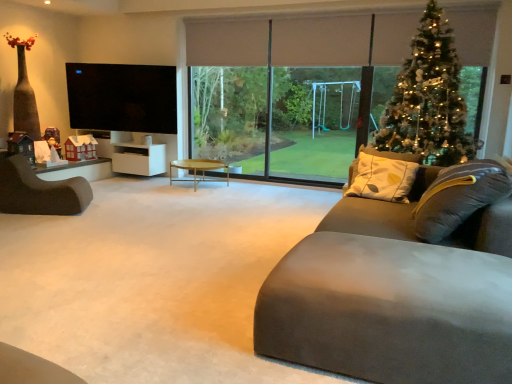
Locate an element on the screen. The height and width of the screenshot is (384, 512). wooden round coffee table at center is located at coordinates (199, 169).

Identify the location of black glossy flat-screen tv at upper left. This screenshot has width=512, height=384. (122, 97).

I want to click on iridescent metallic christmas tree at upper right, so click(x=428, y=99).

What is the approximate height of white matte cabinet at left?

It is 17.47 inches.

Image resolution: width=512 pixels, height=384 pixels. In order to click on wooden round coffee table at center in this screenshot , I will do `click(199, 169)`.

Would you say wooden round coffee table at center is part of dark brown leather chair at left's contents?

Definitely not — wooden round coffee table at center is not inside dark brown leather chair at left.

From a real-world perspective, is dark brown leather chair at left positioned above or below wooden round coffee table at center?

In terms of real-world spatial position, dark brown leather chair at left is above wooden round coffee table at center.

Who is shorter, dark brown leather chair at left or wooden round coffee table at center?

Standing shorter between the two is wooden round coffee table at center.

In the scene shown: Could you tell me if dark brown leather chair at left is turned towards wooden round coffee table at center?

No.

From a real-world perspective, is wooden round coffee table at center beneath transparent glass window at center?

Indeed, from a real-world perspective, wooden round coffee table at center is positioned beneath transparent glass window at center.

Considering the positions of points (184, 165) and (201, 120), is point (184, 165) farther from camera compared to point (201, 120)?

Yes.

From the image's perspective, is wooden round coffee table at center positioned above or below transparent glass window at center?

Based on their image positions, wooden round coffee table at center is located beneath transparent glass window at center.

Is suede couch at lower right taller or shorter than transparent glass window at center?

suede couch at lower right is shorter than transparent glass window at center.

Are suede couch at lower right and transparent glass window at center beside each other?

No, suede couch at lower right is not making contact with transparent glass window at center.

Is suede couch at lower right not within transparent glass window at center?

Yes, suede couch at lower right is outside of transparent glass window at center.

The height and width of the screenshot is (384, 512). I want to click on window above the suede couch at lower right (from a real-world perspective), so click(287, 88).

Is suede-like gray couch at lower right far from transparent glass window at center?

Yes, suede-like gray couch at lower right and transparent glass window at center are located far from each other.

In the scene shown: Considering the relative sizes of suede-like gray couch at lower right and transparent glass window at center in the image provided, is suede-like gray couch at lower right thinner than transparent glass window at center?

Incorrect, the width of suede-like gray couch at lower right is not less than that of transparent glass window at center.

You are a GUI agent. You are given a task and a screenshot of the screen. Output one action in this format:
    pyautogui.click(x=<x>, y=<y>)
    Task: Click on the window behind the suede-like gray couch at lower right
    
    Given the screenshot: What is the action you would take?
    pyautogui.click(x=287, y=88)

Can you confirm if suede-like gray couch at lower right is taller than transparent glass window at center?

No.

Does wooden round coffee table at center have a greater width compared to suede couch at lower right?

Incorrect, the width of wooden round coffee table at center does not surpass that of suede couch at lower right.

Which object is positioned more to the left, wooden round coffee table at center or suede couch at lower right?

From the viewer's perspective, suede couch at lower right appears more on the left side.

Looking at the image, does wooden round coffee table at center seem bigger or smaller compared to suede couch at lower right?

Considering their sizes, wooden round coffee table at center takes up less space than suede couch at lower right.

Is wooden round coffee table at center directly adjacent to suede couch at lower right?

wooden round coffee table at center and suede couch at lower right are clearly separated.

From the image's perspective, between dark brown leather chair at left and suede couch at lower right, which one is located above?

dark brown leather chair at left, from the image's perspective.

Does dark brown leather chair at left have a greater height compared to suede couch at lower right?

Correct, dark brown leather chair at left is much taller as suede couch at lower right.

Which of these two, dark brown leather chair at left or suede couch at lower right, is bigger?

suede couch at lower right.

Is dark brown leather chair at left touching suede couch at lower right?

No, dark brown leather chair at left is not touching suede couch at lower right.

How far apart are transparent glass window at center and iridescent metallic christmas tree at upper right?

transparent glass window at center and iridescent metallic christmas tree at upper right are 4.54 feet apart from each other.

The image size is (512, 384). I want to click on window on the left of iridescent metallic christmas tree at upper right, so click(287, 88).

Considering the relative sizes of transparent glass window at center and iridescent metallic christmas tree at upper right in the image provided, is transparent glass window at center thinner than iridescent metallic christmas tree at upper right?

No, transparent glass window at center is not thinner than iridescent metallic christmas tree at upper right.

Is transparent glass window at center outside of iridescent metallic christmas tree at upper right?

Yes, transparent glass window at center is not within iridescent metallic christmas tree at upper right.

This screenshot has height=384, width=512. In order to click on chair above the wooden round coffee table at center (from a real-world perspective) in this screenshot , I will do `click(39, 191)`.

Identify the location of window to the right of wooden round coffee table at center. This screenshot has height=384, width=512. (287, 88).

Which object lies further to the anchor point white glossy table at left, dark brown leather chair at left or transparent glass window at center?

transparent glass window at center is positioned further to the anchor white glossy table at left.

When comparing their distances from dark brown leather chair at left, does iridescent metallic christmas tree at upper right or black glossy flat-screen tv at upper left seem closer?

black glossy flat-screen tv at upper left is closer to dark brown leather chair at left.

Estimate the real-world distances between objects in this image. Which object is closer to iridescent metallic christmas tree at upper right, suede couch at lower right or transparent glass window at center?

Based on the image, transparent glass window at center appears to be nearer to iridescent metallic christmas tree at upper right.

From the image, which object appears to be farther from white glossy table at left, suede-like gray couch at lower right or wooden round coffee table at center?

suede-like gray couch at lower right lies further to white glossy table at left than the other object.

From the image, which object appears to be nearer to iridescent metallic christmas tree at upper right, suede-like gray couch at lower right or transparent glass window at center?

The object closer to iridescent metallic christmas tree at upper right is transparent glass window at center.

From the image, which object appears to be nearer to white matte cabinet at left, iridescent metallic christmas tree at upper right or suede-like gray couch at lower right?

Based on the image, iridescent metallic christmas tree at upper right appears to be nearer to white matte cabinet at left.

Considering their positions, is dark brown leather chair at left positioned further to white glossy table at left than suede-like gray couch at lower right?

suede-like gray couch at lower right is positioned further to the anchor white glossy table at left.

Which object lies further to the anchor point white glossy table at left, transparent glass window at center or dark brown leather chair at left?

Among the two, transparent glass window at center is located further to white glossy table at left.

Locate an element on the screen. This screenshot has height=384, width=512. window positioned between suede-like gray couch at lower right and wooden round coffee table at center from near to far is located at coordinates pos(287,88).

Where is `chair between suede couch at lower right and white glossy table at left along the z-axis`? The image size is (512, 384). chair between suede couch at lower right and white glossy table at left along the z-axis is located at coordinates (39, 191).

In order to click on studio couch between dark brown leather chair at left and transparent glass window at center in the horizontal direction in this screenshot , I will do `click(399, 289)`.

Identify the location of coffee table between black glossy flat-screen tv at upper left and iridescent metallic christmas tree at upper right in the horizontal direction. The width and height of the screenshot is (512, 384). (199, 169).